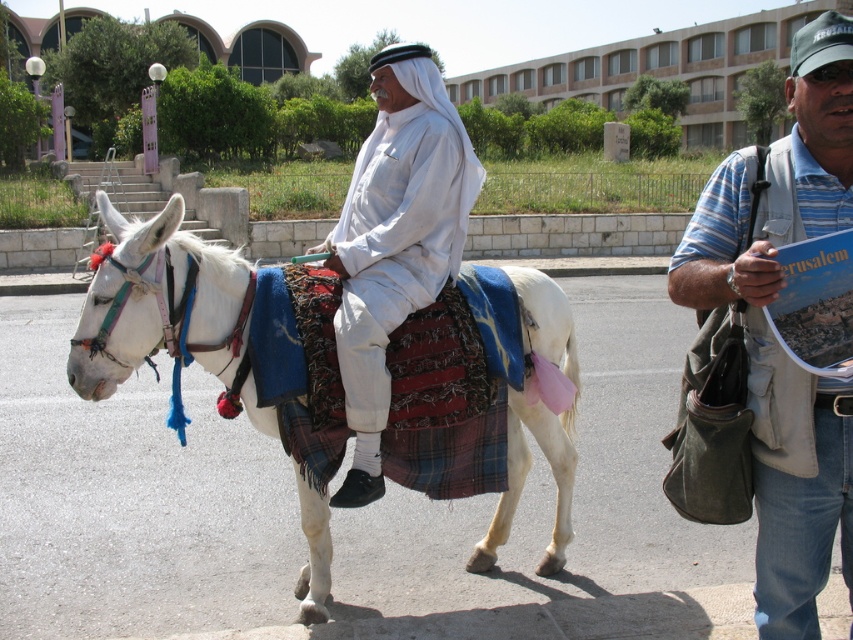
Based on the scene described, which object is wider, the striped cotton shirt at right or the white plaid saddle at center?

The striped cotton shirt at right is wider than the white plaid saddle at center according to the description.

You are a fashion designer observing two shirts in the scene. The striped cotton shirt at right and the white cotton shirt at center. Which shirt would require more fabric to produce?

The striped cotton shirt at right requires more fabric to produce because it is larger in size than the white cotton shirt at center.